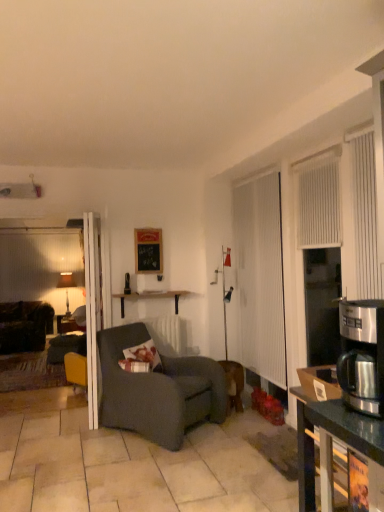
Question: Considering the relative sizes of textured gray pillow at center and stainless steel coffee maker at right in the image provided, is textured gray pillow at center taller than stainless steel coffee maker at right?

Choices:
 (A) no
 (B) yes

Answer: (B)

Question: Is textured gray pillow at center further to camera compared to stainless steel coffee maker at right?

Choices:
 (A) no
 (B) yes

Answer: (B)

Question: Is textured gray pillow at center smaller than stainless steel coffee maker at right?

Choices:
 (A) yes
 (B) no

Answer: (B)

Question: From a real-world perspective, is textured gray pillow at center below stainless steel coffee maker at right?

Choices:
 (A) yes
 (B) no

Answer: (A)

Question: Is textured gray pillow at center to the right of stainless steel coffee maker at right from the viewer's perspective?

Choices:
 (A) no
 (B) yes

Answer: (A)

Question: In terms of size, does black matte picture frame at center appear bigger or smaller than dark gray fabric chair at center?

Choices:
 (A) big
 (B) small

Answer: (B)

Question: Considering the relative positions of black matte picture frame at center and dark gray fabric chair at center in the image provided, is black matte picture frame at center to the left or to the right of dark gray fabric chair at center?

Choices:
 (A) right
 (B) left

Answer: (B)

Question: From a real-world perspective, is black matte picture frame at center positioned above or below dark gray fabric chair at center?

Choices:
 (A) below
 (B) above

Answer: (B)

Question: Would you say black matte picture frame at center is inside or outside dark gray fabric chair at center?

Choices:
 (A) inside
 (B) outside

Answer: (B)

Question: Considering the relative positions of dark brown fabric couch at left and white wood shelf at center in the image provided, is dark brown fabric couch at left to the left or to the right of white wood shelf at center?

Choices:
 (A) right
 (B) left

Answer: (B)

Question: Considering their positions, is dark brown fabric couch at left located in front of or behind white wood shelf at center?

Choices:
 (A) front
 (B) behind

Answer: (B)

Question: Considering the positions of dark brown fabric couch at left and white wood shelf at center in the image, is dark brown fabric couch at left bigger or smaller than white wood shelf at center?

Choices:
 (A) big
 (B) small

Answer: (A)

Question: Is dark brown fabric couch at left taller or shorter than white wood shelf at center?

Choices:
 (A) short
 (B) tall

Answer: (B)

Question: Considering the positions of stainless steel coffee maker at right and white wood shelf at center in the image, is stainless steel coffee maker at right taller or shorter than white wood shelf at center?

Choices:
 (A) short
 (B) tall

Answer: (B)

Question: Do you think stainless steel coffee maker at right is within white wood shelf at center, or outside of it?

Choices:
 (A) inside
 (B) outside

Answer: (B)